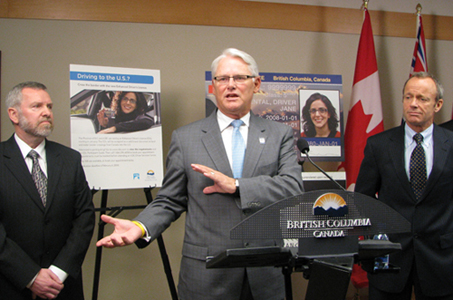
Locate an element on the screen. The width and height of the screenshot is (453, 300). wall is located at coordinates (186, 63).